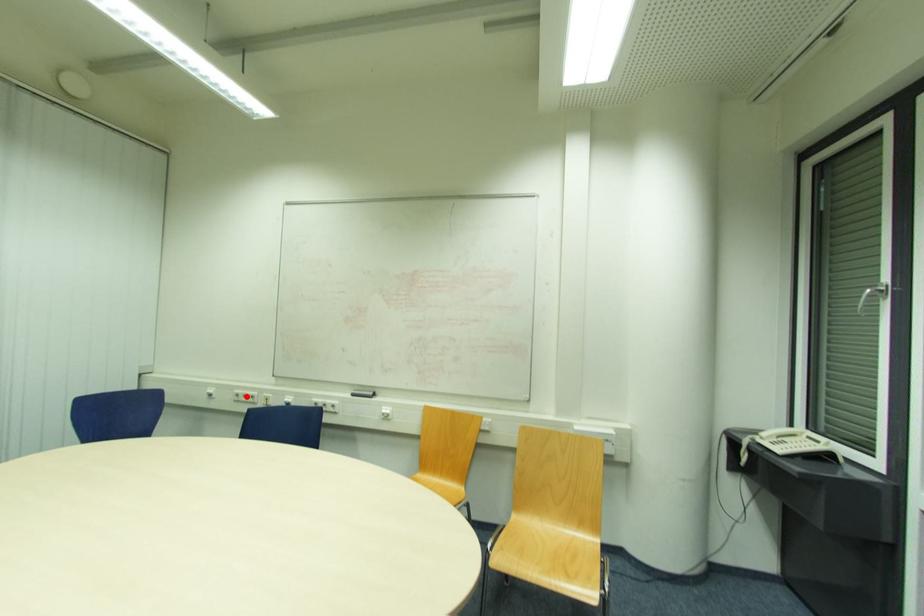
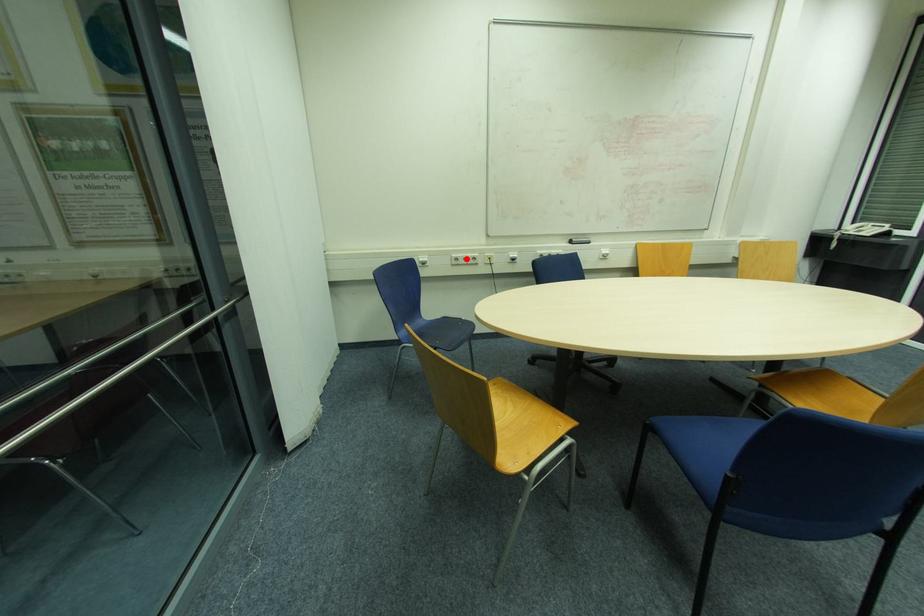
I am providing you with two images of the same scene from different viewpoints. A red point is marked on the first image and another point is marked on the second image. Are the points marked in image1 and image2 representing the same 3D position?

Yes